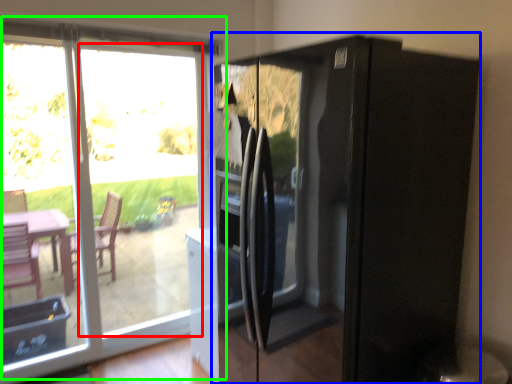
Question: Which is farther away from glass door (highlighted by a red box)? appliance (highlighted by a blue box) or window (highlighted by a green box)?

Choices:
 (A) appliance
 (B) window

Answer: (A)